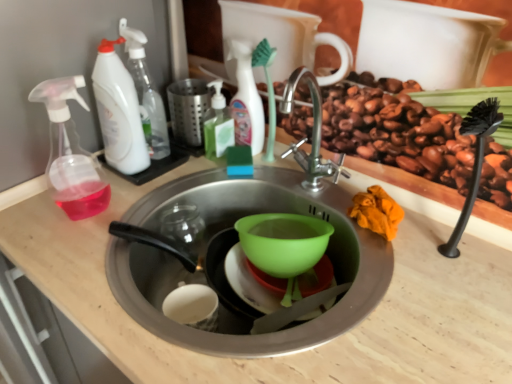
Find the location of `free space above light wood counter top at center (from a real-world perspective)`. free space above light wood counter top at center (from a real-world perspective) is located at coordinates (166, 195).